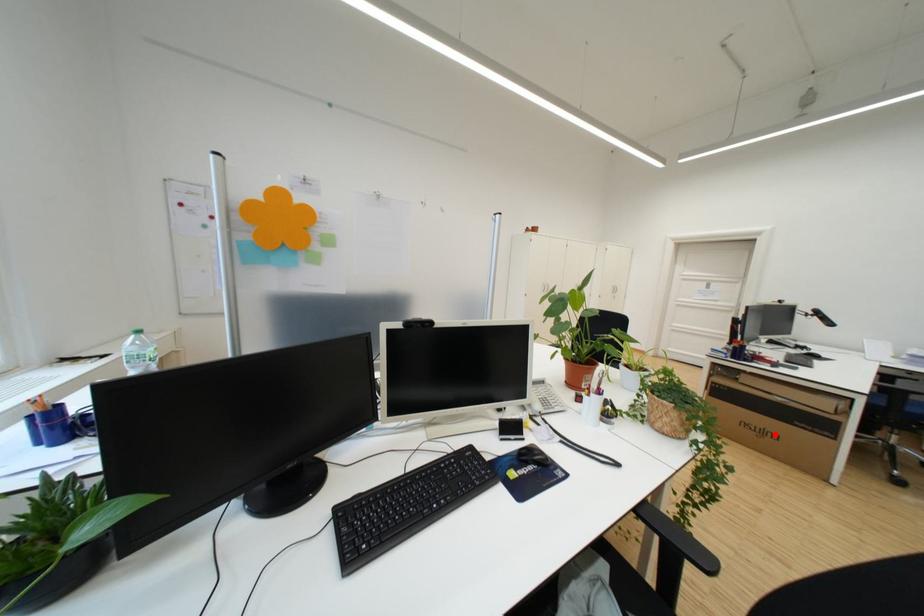
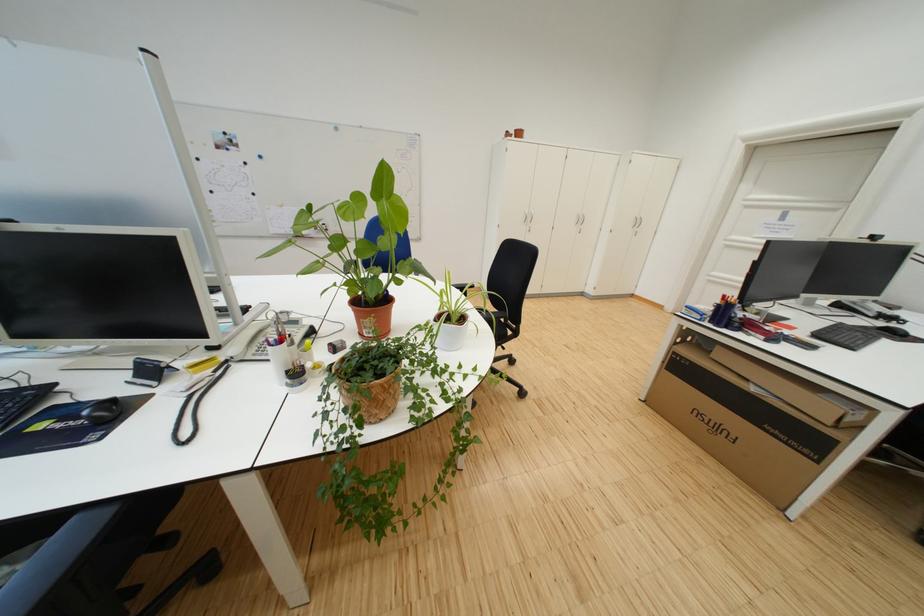
Where in the second image is the point corresponding to the highlighted location from the first image?

(730, 431)